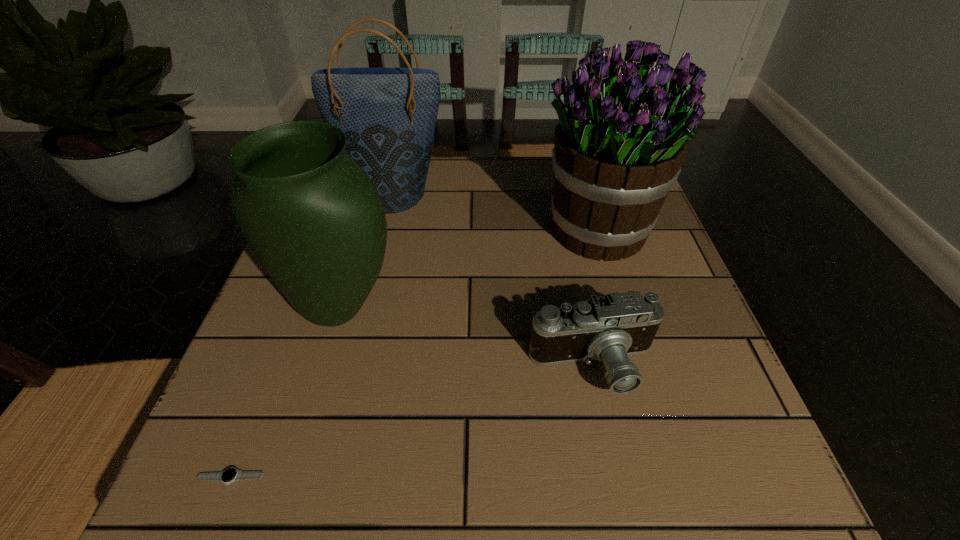
Where is `vacant space located 0.060m on the back of the nearest object`? The width and height of the screenshot is (960, 540). vacant space located 0.060m on the back of the nearest object is located at coordinates (250, 428).

Locate an element on the screen. This screenshot has width=960, height=540. bouquet at the far edge is located at coordinates (624, 128).

Find the location of `shopping bag present at the far edge`. shopping bag present at the far edge is located at coordinates (388, 115).

This screenshot has width=960, height=540. I want to click on object that is at the near edge, so click(229, 475).

Image resolution: width=960 pixels, height=540 pixels. Find the location of `shopping bag that is positioned at the left edge`. shopping bag that is positioned at the left edge is located at coordinates (388, 115).

Locate an element on the screen. vase situated at the left edge is located at coordinates (x=314, y=219).

The image size is (960, 540). Identify the location of watch that is at the left edge. (229, 475).

The width and height of the screenshot is (960, 540). In order to click on bouquet located in the right edge section of the desktop in this screenshot , I will do `click(624, 128)`.

You are a GUI agent. You are given a task and a screenshot of the screen. Output one action in this format:
    pyautogui.click(x=<x>, y=<y>)
    Task: Click on the camera situated at the right edge
    
    Given the screenshot: What is the action you would take?
    pyautogui.click(x=610, y=328)

Locate an element on the screen. This screenshot has height=540, width=960. object situated at the far left corner is located at coordinates (388, 115).